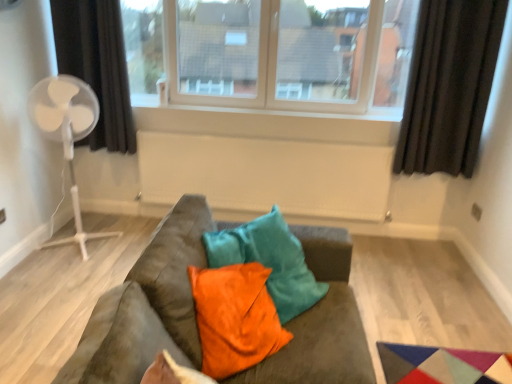
Question: Is white plastic fan at left positioned with its back to white matte radiator at center?

Choices:
 (A) no
 (B) yes

Answer: (A)

Question: Could you tell me if white plastic fan at left is turned towards white matte radiator at center?

Choices:
 (A) yes
 (B) no

Answer: (B)

Question: Would you say white plastic fan at left contains white matte radiator at center?

Choices:
 (A) yes
 (B) no

Answer: (B)

Question: Considering the relative sizes of white plastic fan at left and white matte radiator at center in the image provided, is white plastic fan at left bigger than white matte radiator at center?

Choices:
 (A) no
 (B) yes

Answer: (B)

Question: Is white plastic fan at left to the right of white matte radiator at center from the viewer's perspective?

Choices:
 (A) no
 (B) yes

Answer: (A)

Question: Considering the relative positions of white plastic fan at left and white matte radiator at center in the image provided, is white plastic fan at left to the left of white matte radiator at center from the viewer's perspective?

Choices:
 (A) yes
 (B) no

Answer: (A)

Question: From a real-world perspective, is white matte radiator at center over black fabric curtain at right, the 1th curtain from the right?

Choices:
 (A) no
 (B) yes

Answer: (A)

Question: Is black fabric curtain at right, marked as the 2th curtain in a left-to-right arrangement, at the back of white matte radiator at center?

Choices:
 (A) no
 (B) yes

Answer: (A)

Question: Is white matte radiator at center behind black fabric curtain at right, the 1th curtain from the right?

Choices:
 (A) no
 (B) yes

Answer: (B)

Question: Is white matte radiator at center to the right of black fabric curtain at right, marked as the 2th curtain in a left-to-right arrangement, from the viewer's perspective?

Choices:
 (A) yes
 (B) no

Answer: (B)

Question: From the image's perspective, is white matte radiator at center over black fabric curtain at right, marked as the 2th curtain in a left-to-right arrangement?

Choices:
 (A) yes
 (B) no

Answer: (B)

Question: From the image's perspective, does white matte radiator at center appear lower than black fabric curtain at right, marked as the 2th curtain in a left-to-right arrangement?

Choices:
 (A) no
 (B) yes

Answer: (B)

Question: Does white matte radiator at center have a greater width compared to orange velvet pillow at center?

Choices:
 (A) yes
 (B) no

Answer: (B)